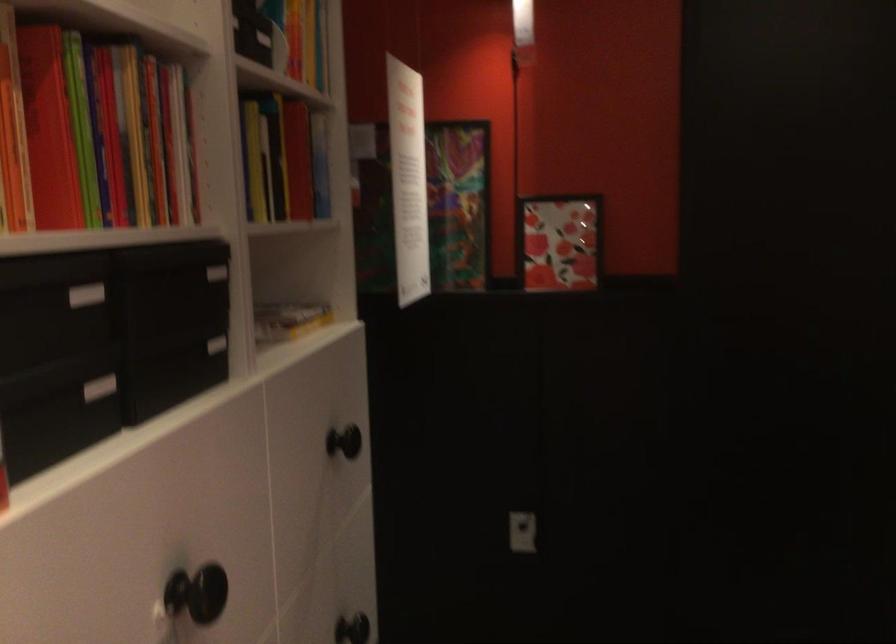
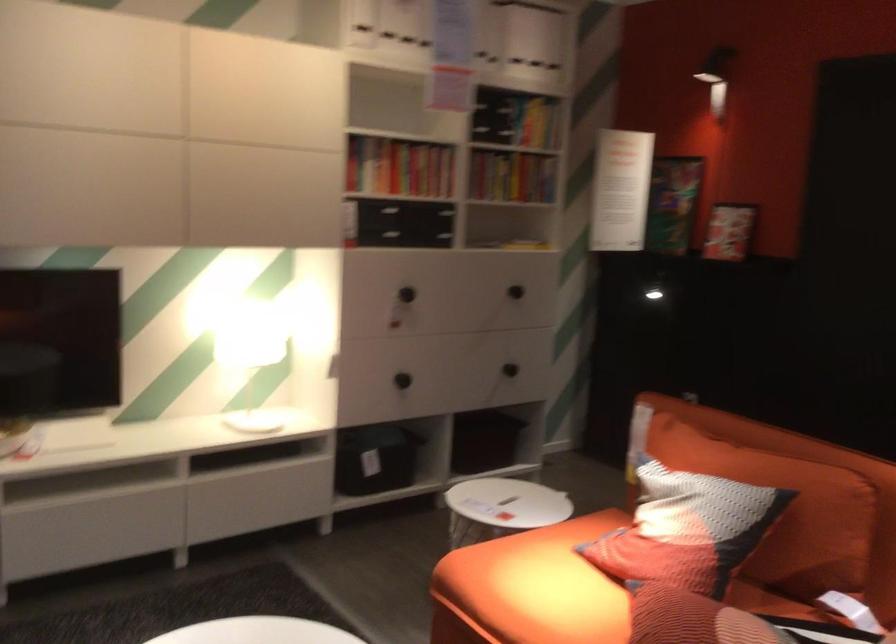
The point at (298, 88) is marked in the first image. Where is the corresponding point in the second image?

(538, 124)